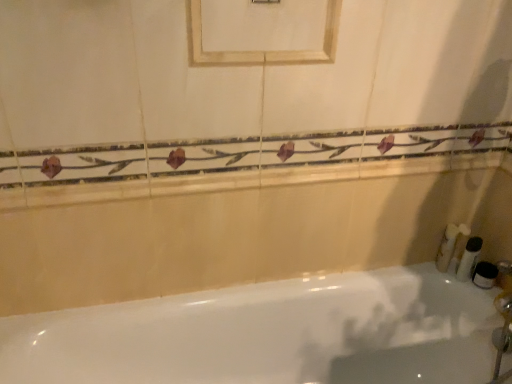
Image resolution: width=512 pixels, height=384 pixels. Find the location of `vacant area situated to the left side of white plastic bottle at right, the second toiletry from the right`. vacant area situated to the left side of white plastic bottle at right, the second toiletry from the right is located at coordinates (423, 275).